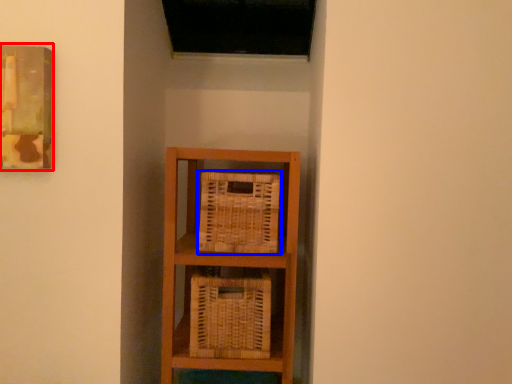
Question: Which object is closer to the camera taking this photo, picture frame (highlighted by a red box) or basket (highlighted by a blue box)?

Choices:
 (A) picture frame
 (B) basket

Answer: (A)